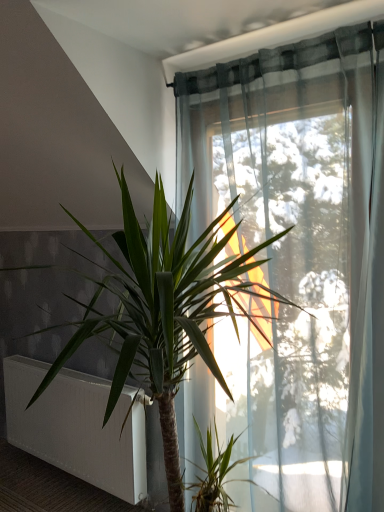
Image resolution: width=384 pixels, height=512 pixels. What are the coordinates of `vacant space underneath white matte radiator at lower left (from a real-world perspective)` in the screenshot? It's located at (92, 490).